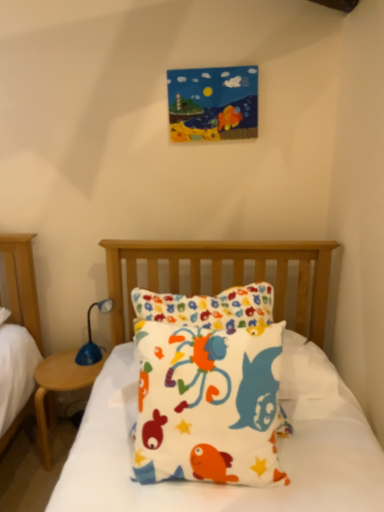
Question: Are blue plastic table lamp at left and wooden at left located far from each other?

Choices:
 (A) yes
 (B) no

Answer: (B)

Question: Considering the relative positions of blue plastic table lamp at left and wooden at left in the image provided, is blue plastic table lamp at left to the left of wooden at left from the viewer's perspective?

Choices:
 (A) no
 (B) yes

Answer: (A)

Question: From a real-world perspective, is blue plastic table lamp at left below wooden at left?

Choices:
 (A) no
 (B) yes

Answer: (A)

Question: Is blue plastic table lamp at left directly adjacent to wooden at left?

Choices:
 (A) yes
 (B) no

Answer: (B)

Question: Considering the relative sizes of blue plastic table lamp at left and wooden at left in the image provided, is blue plastic table lamp at left taller than wooden at left?

Choices:
 (A) yes
 (B) no

Answer: (B)

Question: From the image's perspective, is wooden at left located above or below fluffy cotton pillow at center?

Choices:
 (A) below
 (B) above

Answer: (A)

Question: In terms of width, does wooden at left look wider or thinner when compared to fluffy cotton pillow at center?

Choices:
 (A) thin
 (B) wide

Answer: (B)

Question: Based on their sizes in the image, would you say wooden at left is bigger or smaller than fluffy cotton pillow at center?

Choices:
 (A) big
 (B) small

Answer: (B)

Question: In the image, is wooden at left positioned in front of or behind fluffy cotton pillow at center?

Choices:
 (A) behind
 (B) front

Answer: (A)

Question: Is blue plastic table lamp at left inside the boundaries of fluffy cotton pillow at center, or outside?

Choices:
 (A) inside
 (B) outside

Answer: (B)

Question: From a real-world perspective, relative to fluffy cotton pillow at center, is blue plastic table lamp at left vertically above or below?

Choices:
 (A) below
 (B) above

Answer: (A)

Question: Is blue plastic table lamp at left in front of or behind fluffy cotton pillow at center in the image?

Choices:
 (A) front
 (B) behind

Answer: (B)

Question: In terms of width, does blue plastic table lamp at left look wider or thinner when compared to fluffy cotton pillow at center?

Choices:
 (A) wide
 (B) thin

Answer: (B)

Question: From a real-world perspective, is blue plastic table lamp at left above or below wooden at left?

Choices:
 (A) below
 (B) above

Answer: (B)

Question: Does point (92, 347) appear closer or farther from the camera than point (41, 378)?

Choices:
 (A) farther
 (B) closer

Answer: (A)